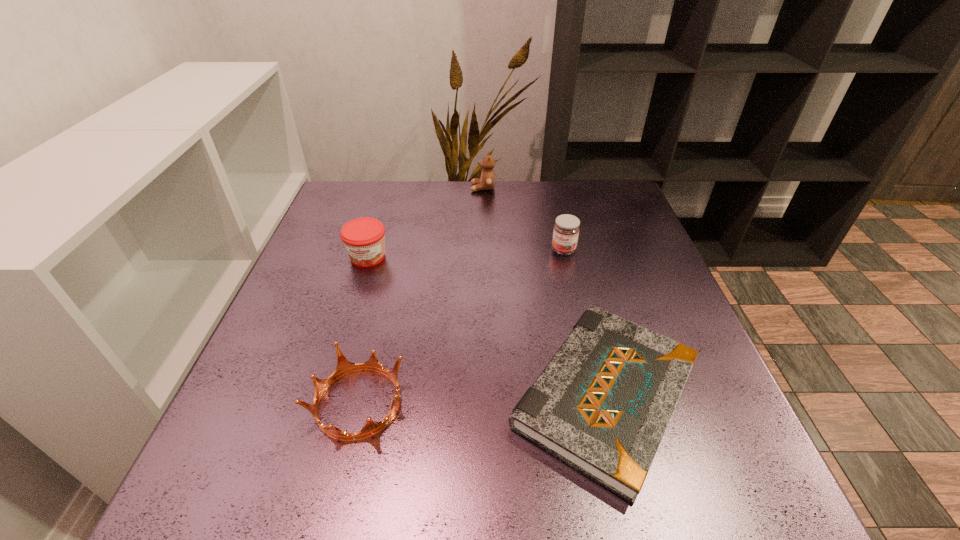
In order to click on free space that satisfies the following two spatial constraints: 1. on the back side of the notebook; 2. on the front-facing side of the tallest object in this screenshot , I will do `click(554, 188)`.